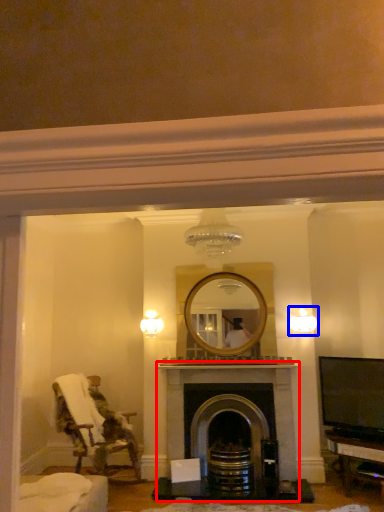
Question: Which object appears closest to the camera in this image, fireplace (highlighted by a red box) or light fixture (highlighted by a blue box)?

Choices:
 (A) fireplace
 (B) light fixture

Answer: (A)